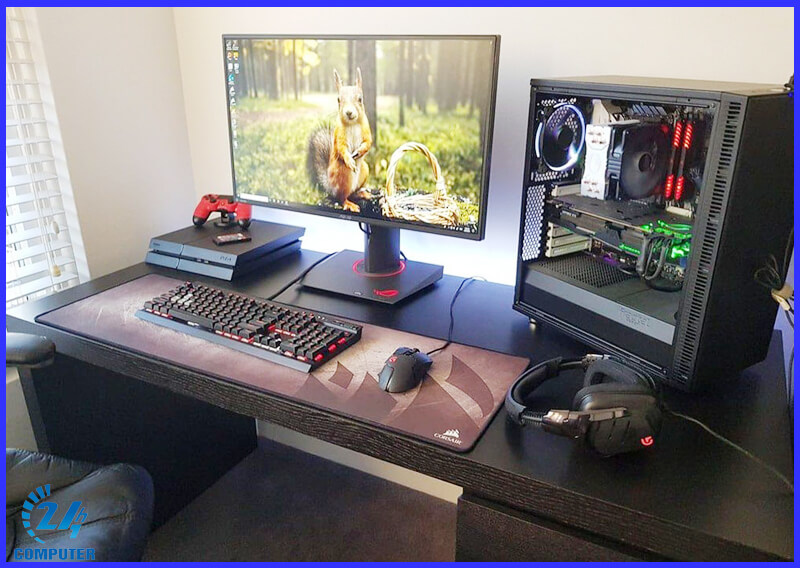
Locate an element on the screen. floor is located at coordinates (314, 534).